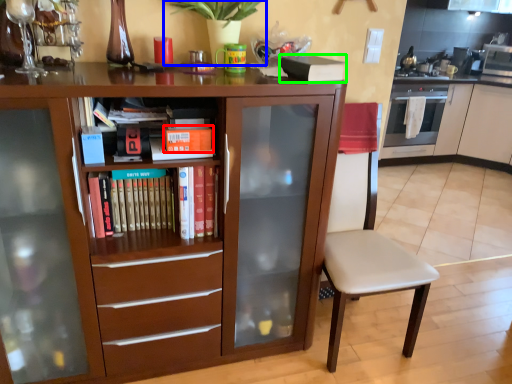
Question: Based on their relative distances, which object is nearer to paperback book (highlighted by a red box)? Choose from plant (highlighted by a blue box) and paperback book (highlighted by a green box).

Choices:
 (A) plant
 (B) paperback book

Answer: (A)